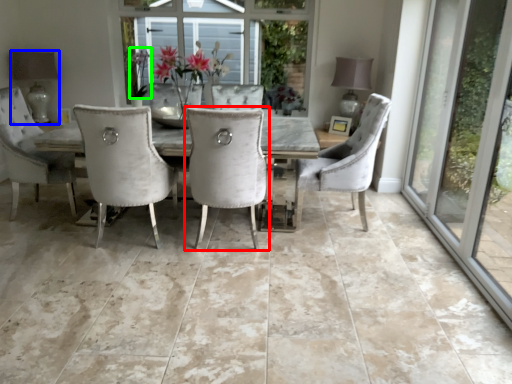
Question: Based on their relative distances, which object is nearer to chair (highlighted by a red box)? Choose from lamp (highlighted by a blue box) and plant (highlighted by a green box).

Choices:
 (A) lamp
 (B) plant

Answer: (B)